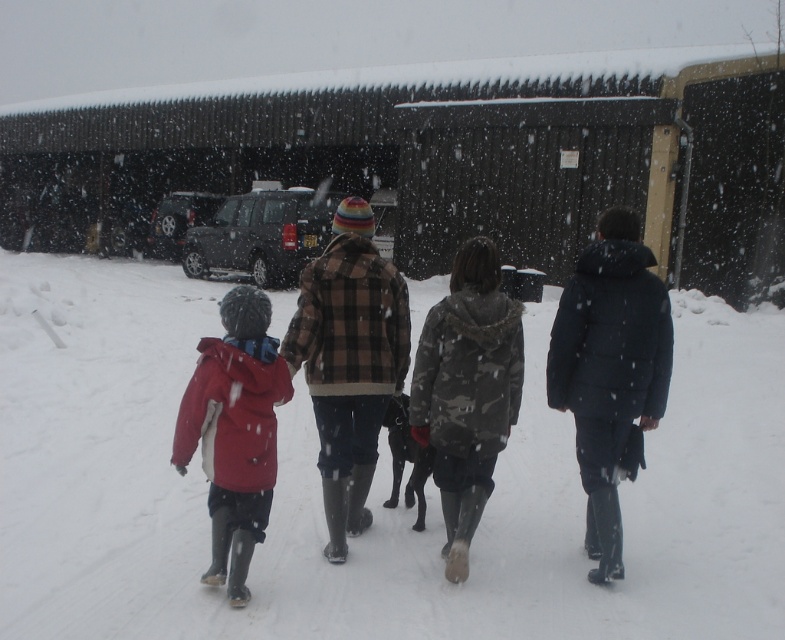
Locate an element on the screen. This screenshot has width=785, height=640. red plaid jacket at center is located at coordinates (309, 390).

Is red plaid jacket at center in front of brown plaid jacket at center?

Yes, it is.

You are a GUI agent. You are given a task and a screenshot of the screen. Output one action in this format:
    pyautogui.click(x=<x>, y=<y>)
    Task: Click on the red plaid jacket at center
    The image size is (785, 640).
    Given the screenshot: What is the action you would take?
    pyautogui.click(x=309, y=390)

You are a GUI agent. You are given a task and a screenshot of the screen. Output one action in this format:
    pyautogui.click(x=<x>, y=<y>)
    Task: Click on the red plaid jacket at center
    The image size is (785, 640).
    Given the screenshot: What is the action you would take?
    pyautogui.click(x=309, y=390)

Based on the photo, is brown plaid jacket at center to the right of camo fabric jacket at center from the viewer's perspective?

In fact, brown plaid jacket at center is to the left of camo fabric jacket at center.

Does brown plaid jacket at center appear under camo fabric jacket at center?

Incorrect, brown plaid jacket at center is not positioned below camo fabric jacket at center.

Is point (378, 305) more distant than point (447, 396)?

That is True.

Find the location of a particular element. This screenshot has height=640, width=785. brown plaid jacket at center is located at coordinates (349, 362).

Does point (448, 497) come closer to viewer compared to point (187, 416)?

No, (448, 497) is behind (187, 416).

Based on the photo, can you confirm if camo fabric jacket at center is shorter than matte red jacket at left?

In fact, camo fabric jacket at center may be taller than matte red jacket at left.

Describe the element at coordinates (466, 392) in the screenshot. I see `camo fabric jacket at center` at that location.

Locate an element on the screen. Image resolution: width=785 pixels, height=640 pixels. camo fabric jacket at center is located at coordinates (466, 392).